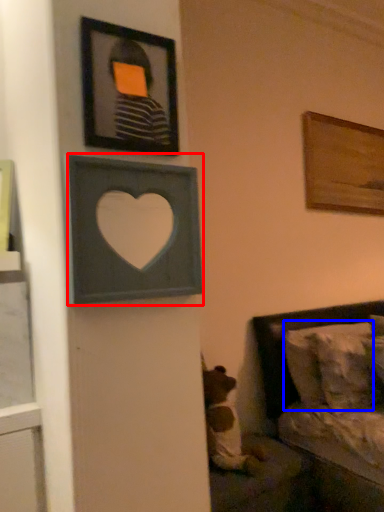
Question: Which of the following is the closest to the observer, picture frame (highlighted by a red box) or pillow (highlighted by a blue box)?

Choices:
 (A) picture frame
 (B) pillow

Answer: (A)